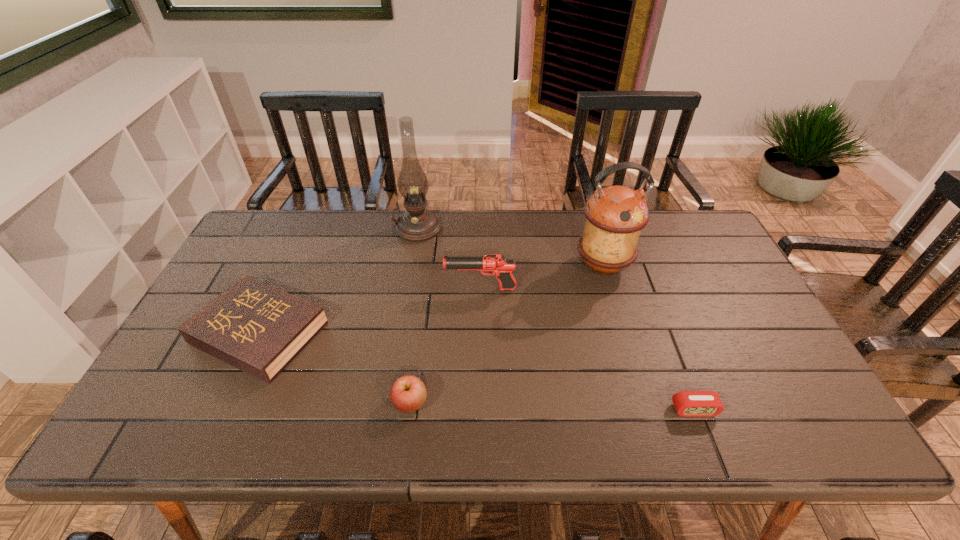
At what (x,y) coordinates should I click in order to perform the action: click on vacant space at the near edge of the desktop. Please return your answer as a coordinate pair (x, y). The width and height of the screenshot is (960, 540). Looking at the image, I should click on (549, 427).

This screenshot has height=540, width=960. Identify the location of vacant point at the left edge. (252, 264).

Identify the location of free region at the right edge of the desktop. The width and height of the screenshot is (960, 540). (751, 306).

Where is `free region at the far left corner of the desktop`? The image size is (960, 540). free region at the far left corner of the desktop is located at coordinates (297, 225).

The width and height of the screenshot is (960, 540). Identify the location of free region at the near right corner of the desktop. (761, 429).

The height and width of the screenshot is (540, 960). In order to click on free spot between the farther oil lamp and the leftmost object in this screenshot , I will do tap(339, 281).

Image resolution: width=960 pixels, height=540 pixels. I want to click on free space between the left oil lamp and the right oil lamp, so click(511, 247).

This screenshot has height=540, width=960. Find the location of `free spot between the shortest object and the left oil lamp`. free spot between the shortest object and the left oil lamp is located at coordinates (556, 319).

Locate an element on the screen. The height and width of the screenshot is (540, 960). vacant area that lies between the alarm clock and the farthest object is located at coordinates (556, 319).

Image resolution: width=960 pixels, height=540 pixels. Find the location of `blank region between the fourth tallest object and the shortest object`. blank region between the fourth tallest object and the shortest object is located at coordinates (552, 406).